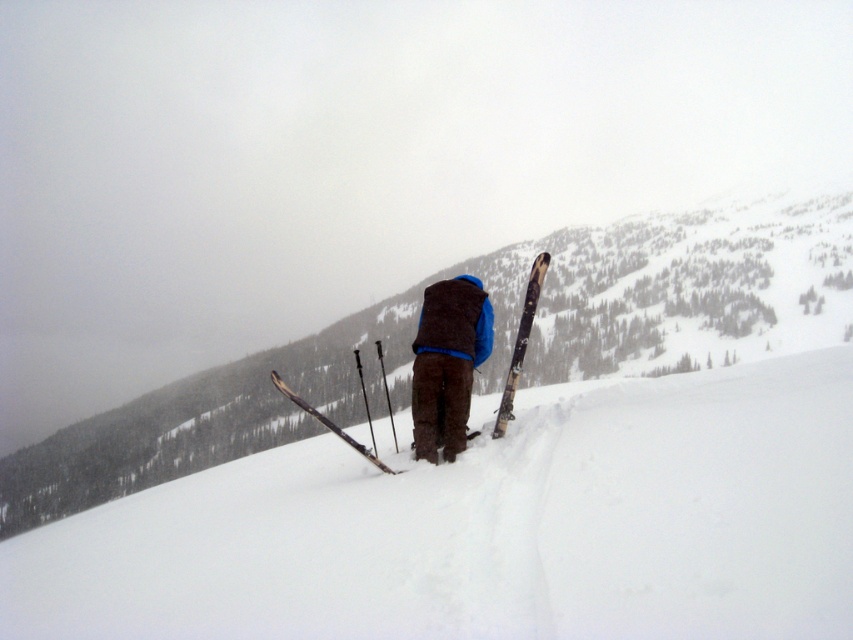
Question: Which object is the closest to the dark brown fleece vest at center?

Choices:
 (A) dark brown vest at center
 (B) wooden ski at center

Answer: (A)

Question: Which of the following is the farthest from the observer?

Choices:
 (A) (541, 260)
 (B) (422, 294)

Answer: (A)

Question: Is dark brown vest at center closer to the viewer compared to wooden ski at right?

Choices:
 (A) no
 (B) yes

Answer: (B)

Question: Can you confirm if dark brown vest at center is bigger than wooden ski at center?

Choices:
 (A) no
 (B) yes

Answer: (A)

Question: Which point is farther to the camera?

Choices:
 (A) (293, 392)
 (B) (769, 516)

Answer: (A)

Question: Does dark brown fleece vest at center have a lesser width compared to wooden ski at center?

Choices:
 (A) yes
 (B) no

Answer: (A)